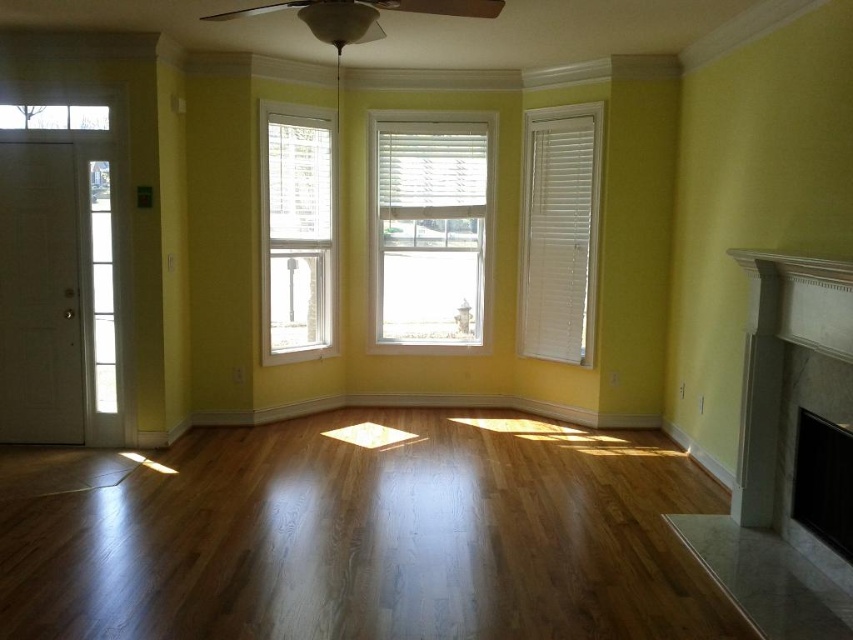
Question: Which object appears farthest from the camera in this image?

Choices:
 (A) white marble fireplace at right
 (B) white matte window at center

Answer: (B)

Question: Among these points, which one is farthest from the camera?

Choices:
 (A) (590, 488)
 (B) (730, 545)
 (C) (315, 198)
 (D) (556, 310)

Answer: (D)

Question: Is white marble fireplace at right bigger than white matte window at center?

Choices:
 (A) no
 (B) yes

Answer: (B)

Question: Among these objects, which one is farthest from the camera?

Choices:
 (A) white wood window at center
 (B) white wood blinds at right

Answer: (B)

Question: From the image, what is the correct spatial relationship of white wood window at center in relation to white wood blinds at right?

Choices:
 (A) above
 (B) below

Answer: (B)

Question: Is shiny brown hardwood floor at center wider than white matte window at center?

Choices:
 (A) yes
 (B) no

Answer: (A)